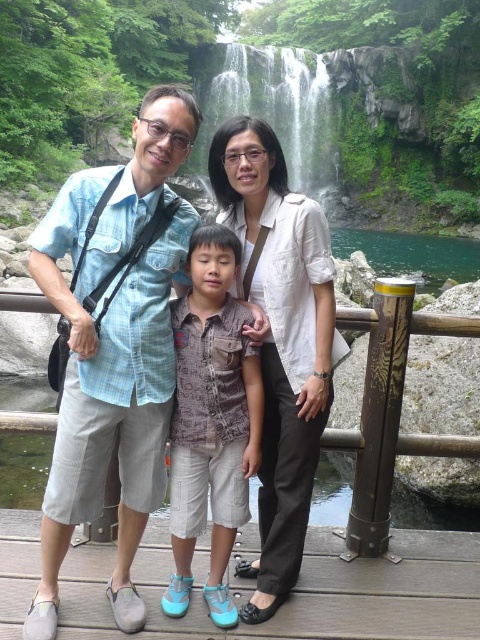
You are a photographer trying to capture a family portrait. You need to ensure that the light blue denim shirt at center and the brown printed shirt at center are both visible in the photo. Based on their heights, which one might you need to adjust to ensure both are fully visible?

The light blue denim shirt at center is much taller than the brown printed shirt at center, so you might need to lower the camera angle or have the person wearing the light blue denim shirt crouch slightly to ensure both are fully visible in the photo.

Based on the scene description, which object is larger when viewed from the perspective of someone standing at the wooden platform? The white cotton blouse at center or the green mossy rock at upper center?

The green mossy rock at upper center is larger than the white cotton blouse at center.